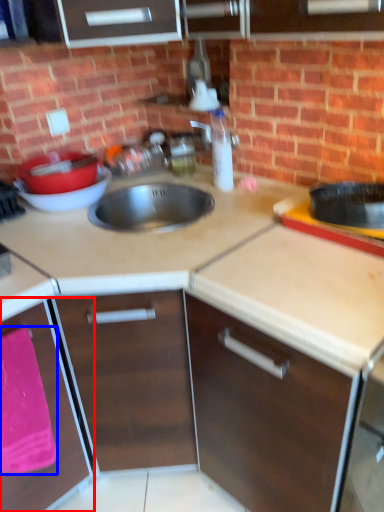
Question: Among these objects, which one is farthest to the camera, cabinetry (highlighted by a red box) or blanket (highlighted by a blue box)?

Choices:
 (A) cabinetry
 (B) blanket

Answer: (B)